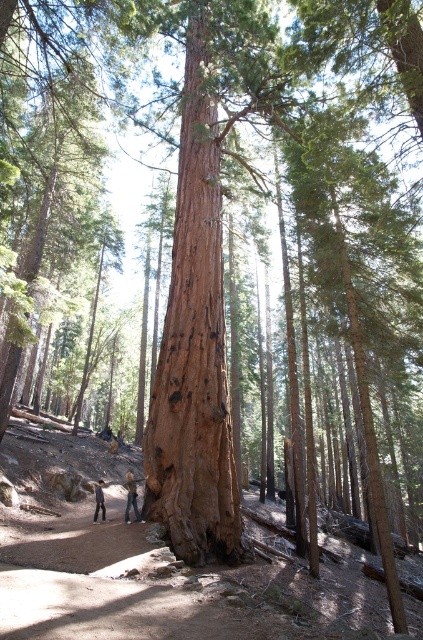
Question: Can you confirm if denim jeans at center is bigger than denim jeans at lower center?

Choices:
 (A) no
 (B) yes

Answer: (A)

Question: Observing the image, what is the correct spatial positioning of denim jeans at center in reference to denim jeans at lower center?

Choices:
 (A) above
 (B) below

Answer: (A)

Question: Can you confirm if denim jeans at center is thinner than denim jeans at lower center?

Choices:
 (A) no
 (B) yes

Answer: (B)

Question: Which object is farther from the camera taking this photo?

Choices:
 (A) denim jeans at lower center
 (B) denim jeans at center

Answer: (A)

Question: Which object appears closest to the camera in this image?

Choices:
 (A) denim jeans at center
 (B) denim jeans at lower center

Answer: (A)